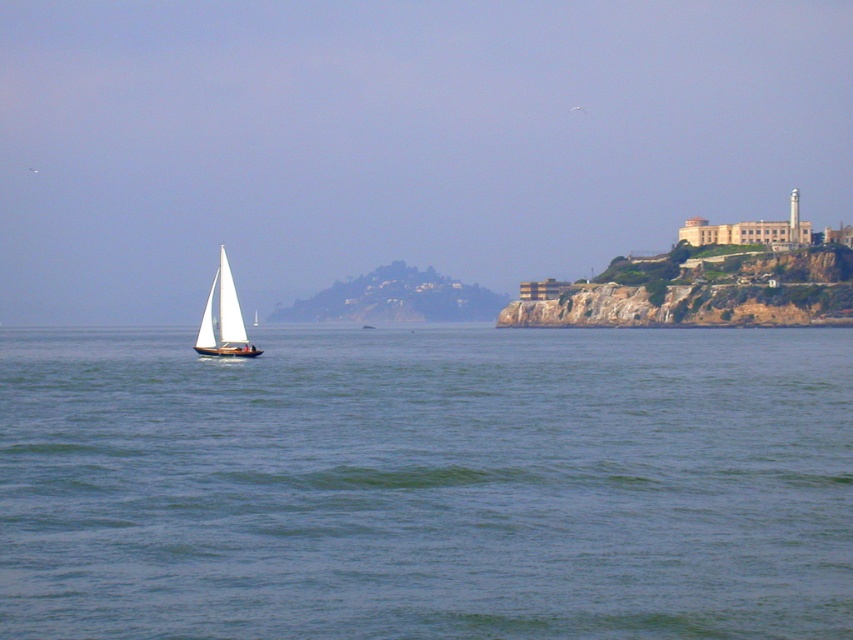
You are a photographer planning to capture the white matte sailboat at left and the green water at center in a single shot. Based on their sizes in the image, which object would appear larger in your photo?

The white matte sailboat at left appears larger than the green water at center in the image because the green water at center is not as tall as the white matte sailboat at left.

You are a photographer planning to take a photo of the green water at center and the white matte sailboat at left. If you want to ensure both are in focus, which one should you focus on first considering their positions?

The green water at center is in front of the white matte sailboat at left, so you should focus on the green water at center first to ensure both are in focus.

You are a photographer planning to capture the entire scene of the green water at center and the white matte sailboat at left in one shot. Based on their sizes, which object would require you to stand further back to ensure both are fully visible in the frame?

The green water at center has a larger size compared to the white matte sailboat at left, so you would need to stand further back to ensure both are fully visible in the frame.